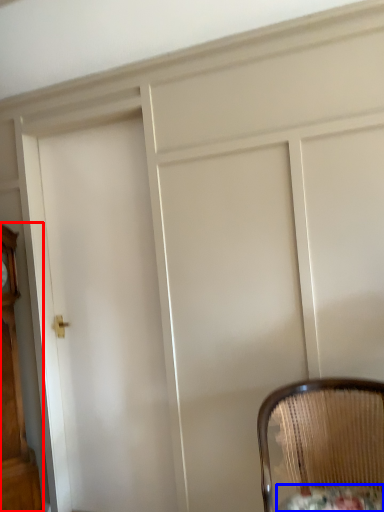
Question: Which point is closer to the camera, furniture (highlighted by a red box) or round table (highlighted by a blue box)?

Choices:
 (A) furniture
 (B) round table

Answer: (B)